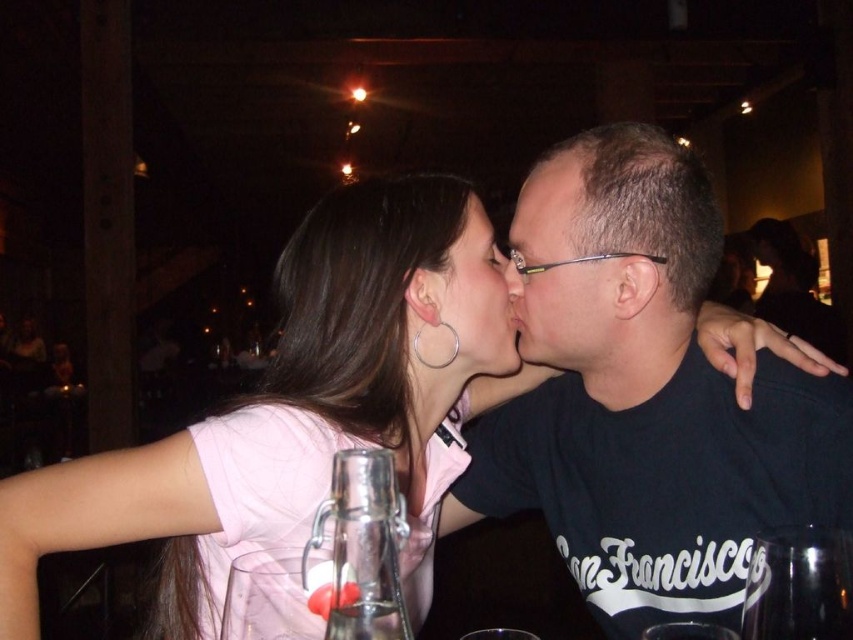
Who is taller, matte black face at center or matte black nose at center?

matte black face at center

Looking at this image, which is more to the right, matte black face at center or matte black nose at center?

Positioned to the right is matte black nose at center.

At what (x,y) coordinates should I click in order to perform the action: click on matte black face at center. Please return your answer as a coordinate pair (x, y). The width and height of the screenshot is (853, 640). Looking at the image, I should click on (473, 301).

Where is `matte black face at center`? matte black face at center is located at coordinates (473, 301).

Between black matte shirt at center and pink fabric shirt at center, which one is positioned lower?

Positioned lower is pink fabric shirt at center.

Does black matte shirt at center have a lesser height compared to pink fabric shirt at center?

Incorrect, black matte shirt at center's height does not fall short of pink fabric shirt at center's.

Between point (758, 433) and point (381, 285), which one is positioned in front?

Point (758, 433) is more forward.

Locate an element on the screen. The width and height of the screenshot is (853, 640). black matte shirt at center is located at coordinates (643, 396).

Where is `pink fabric shirt at center`? pink fabric shirt at center is located at coordinates (277, 413).

Can you confirm if pink fabric shirt at center is positioned to the right of matte black nose at center?

No, pink fabric shirt at center is not to the right of matte black nose at center.

Where is `pink fabric shirt at center`? The image size is (853, 640). pink fabric shirt at center is located at coordinates (277, 413).

In order to click on pink fabric shirt at center in this screenshot , I will do `click(277, 413)`.